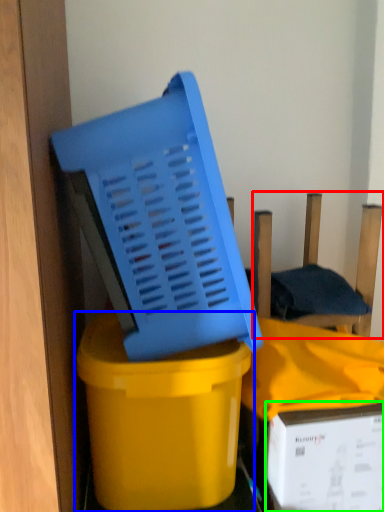
Question: Which object is the farthest from chair (highlighted by a red box)? Choose among these: waste container (highlighted by a blue box) or box (highlighted by a green box).

Choices:
 (A) waste container
 (B) box

Answer: (A)